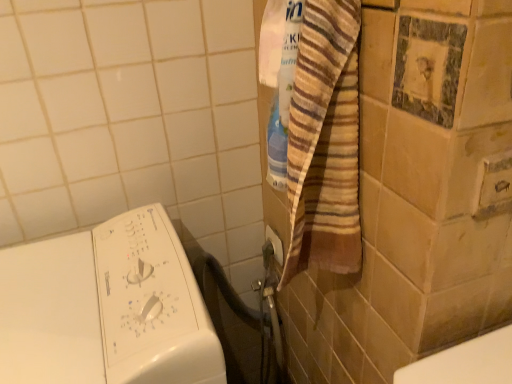
Question: Is metallic silver plug at lower center thinner than white glossy washing machine at upper left?

Choices:
 (A) yes
 (B) no

Answer: (A)

Question: From the image's perspective, is metallic silver plug at lower center beneath white glossy washing machine at upper left?

Choices:
 (A) no
 (B) yes

Answer: (A)

Question: Considering the relative sizes of metallic silver plug at lower center and white glossy washing machine at upper left in the image provided, is metallic silver plug at lower center shorter than white glossy washing machine at upper left?

Choices:
 (A) no
 (B) yes

Answer: (B)

Question: From a real-world perspective, is metallic silver plug at lower center on top of white glossy washing machine at upper left?

Choices:
 (A) no
 (B) yes

Answer: (B)

Question: Is white glossy washing machine at upper left at the back of metallic silver plug at lower center?

Choices:
 (A) yes
 (B) no

Answer: (B)

Question: Is metallic silver plug at lower center not inside white glossy washing machine at upper left?

Choices:
 (A) no
 (B) yes

Answer: (B)

Question: Can you confirm if white glossy washing machine at upper left is taller than metallic silver plug at lower center?

Choices:
 (A) yes
 (B) no

Answer: (A)

Question: Does white glossy washing machine at upper left have a larger size compared to metallic silver plug at lower center?

Choices:
 (A) yes
 (B) no

Answer: (A)

Question: Is white glossy washing machine at upper left facing towards metallic silver plug at lower center?

Choices:
 (A) no
 (B) yes

Answer: (A)

Question: Is the position of white glossy washing machine at upper left more distant than that of metallic silver plug at lower center?

Choices:
 (A) no
 (B) yes

Answer: (A)

Question: From the image's perspective, is white glossy washing machine at upper left located above metallic silver plug at lower center?

Choices:
 (A) no
 (B) yes

Answer: (A)

Question: Is metallic silver plug at lower center completely or partially inside white glossy washing machine at upper left?

Choices:
 (A) yes
 (B) no

Answer: (B)

Question: In the image, is metallic silver plug at lower center on the left side or the right side of white glossy washing machine at upper left?

Choices:
 (A) left
 (B) right

Answer: (B)